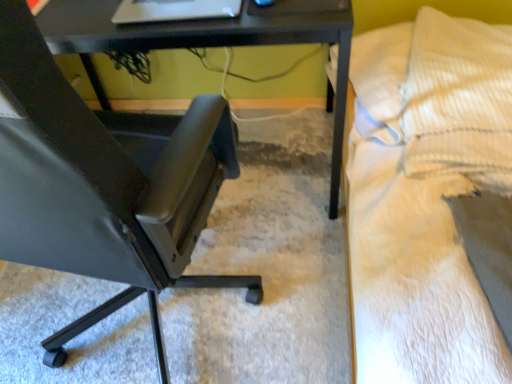
Question: From their relative heights in the image, would you say matte black chair at left is taller or shorter than yellow corduroy pillow at upper right?

Choices:
 (A) short
 (B) tall

Answer: (B)

Question: Is matte black chair at left spatially inside yellow corduroy pillow at upper right, or outside of it?

Choices:
 (A) inside
 (B) outside

Answer: (B)

Question: Which object is the closest to the matte black chair at left?

Choices:
 (A) white textured bed at right
 (B) yellow corduroy pillow at upper right
 (C) black plastic table at center

Answer: (C)

Question: Estimate the real-world distances between objects in this image. Which object is closer to the black plastic table at center?

Choices:
 (A) yellow corduroy pillow at upper right
 (B) white textured bed at right
 (C) matte black chair at left

Answer: (B)